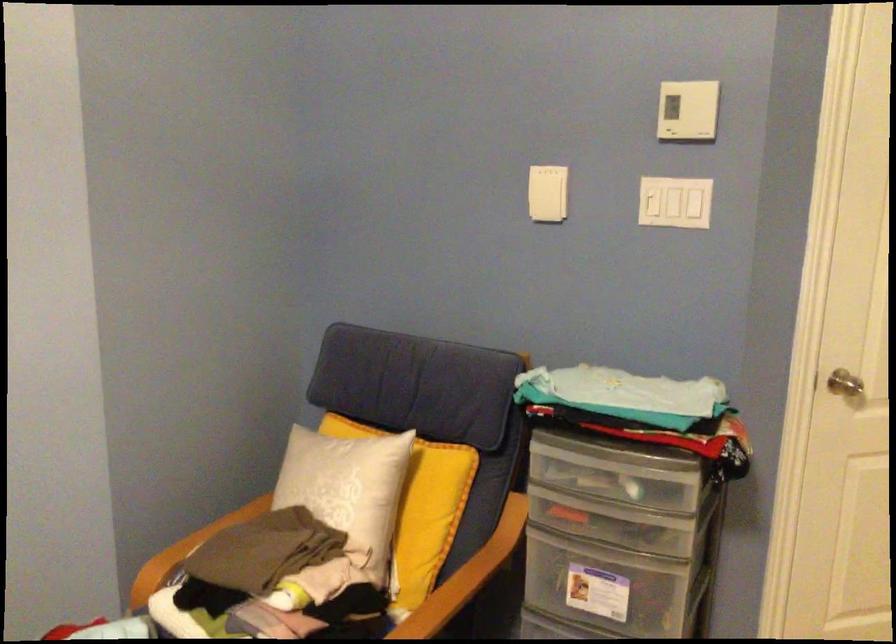
Find the location of a particular element. This screenshot has width=896, height=644. silver door handle is located at coordinates (846, 384).